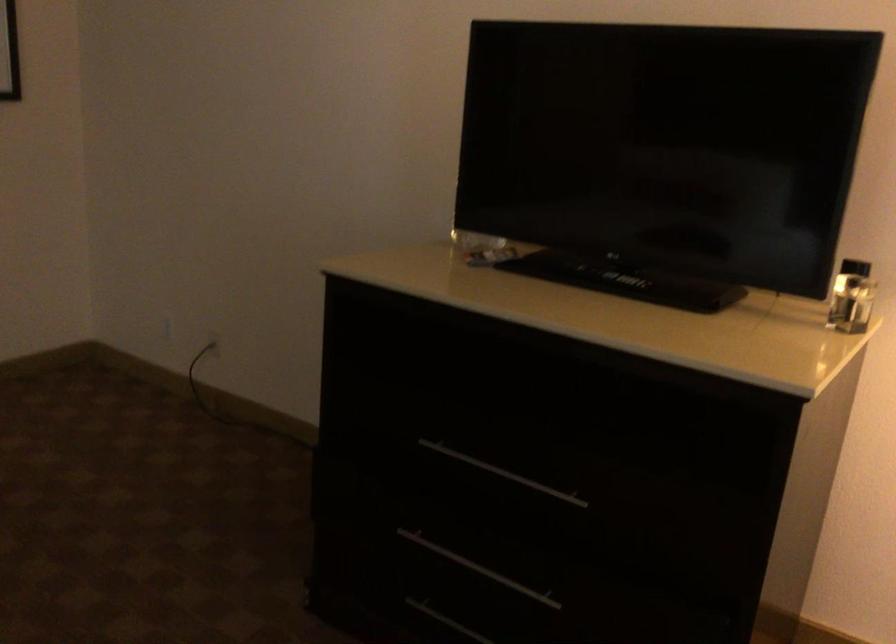
This screenshot has height=644, width=896. Identify the location of black remote control. (625, 279).